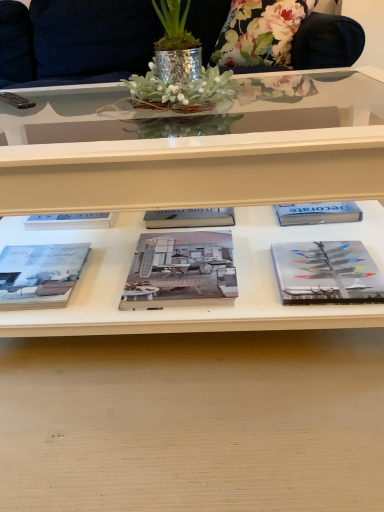
The height and width of the screenshot is (512, 384). Describe the element at coordinates (326, 273) in the screenshot. I see `gray matte book at right, which is the 3th book from left to right` at that location.

This screenshot has width=384, height=512. What are the coordinates of `black plastic remote control at upper left` in the screenshot? It's located at (16, 100).

The height and width of the screenshot is (512, 384). Describe the element at coordinates (39, 274) in the screenshot. I see `matte gray book at lower left, which is the 1th book in left-to-right order` at that location.

Measure the distance between floral fabric pillow at upper center and camera.

floral fabric pillow at upper center is 1.83 meters from camera.

The height and width of the screenshot is (512, 384). In order to click on shiny metallic pot at center in this screenshot , I will do `click(177, 69)`.

Which point is more distant from viewer, (277, 269) or (38, 396)?

The point (277, 269) is more distant.

Is gray matte book at right, which is the 3th book from left to right, positioned far away from wooden desk at center?

No, gray matte book at right, which is the 3th book from left to right, is not far from wooden desk at center.

Between gray matte book at right, which is the 3th book from left to right, and wooden desk at center, which one is positioned behind?

gray matte book at right, which is the 3th book from left to right, is further away from the camera.

Can you confirm if gray matte book at right, which is the 3th book from left to right, is bigger than wooden desk at center?

Incorrect, gray matte book at right, which is the 3th book from left to right, is not larger than wooden desk at center.

From a real-world perspective, is shiny metallic pot at center physically below black plastic remote control at upper left?

No, from a real-world perspective, shiny metallic pot at center is not under black plastic remote control at upper left.

Which is behind, point (197, 86) or point (13, 95)?

The point (13, 95) is farther from the camera.

Are shiny metallic pot at center and black plastic remote control at upper left making contact?

There is a gap between shiny metallic pot at center and black plastic remote control at upper left.

Which of these two, shiny metallic pot at center or black plastic remote control at upper left, is wider?

With larger width is shiny metallic pot at center.

Is wooden desk at center closer to the viewer compared to floral fabric pillow at upper center?

Yes, wooden desk at center is closer to the viewer.

How different are the orientations of wooden desk at center and floral fabric pillow at upper center in degrees?

wooden desk at center and floral fabric pillow at upper center are facing 148 degrees away from each other.

Is wooden desk at center thinner than floral fabric pillow at upper center?

In fact, wooden desk at center might be wider than floral fabric pillow at upper center.

From a real-world perspective, is shiny metallic pot at center physically located above or below floral fabric pillow at upper center?

Clearly, from a real-world perspective, shiny metallic pot at center is above floral fabric pillow at upper center.

Between shiny metallic pot at center and floral fabric pillow at upper center, which one appears on the right side from the viewer's perspective?

floral fabric pillow at upper center.

I want to click on flower that is under the shiny metallic pot at center (from a real-world perspective), so click(x=260, y=33).

From a real-world perspective, which is physically below, gray matte book at right, acting as the 1th book starting from the right, or black plastic remote control at upper left?

gray matte book at right, acting as the 1th book starting from the right, is physically lower.

Does gray matte book at right, which is the 3th book from left to right, have a larger size compared to black plastic remote control at upper left?

Yes.

Is gray matte book at right, acting as the 1th book starting from the right, next to black plastic remote control at upper left and touching it?

There is a gap between gray matte book at right, acting as the 1th book starting from the right, and black plastic remote control at upper left.

From the image's perspective, count 2nd books downward from the black plastic remote control at upper left and point to it. Please provide its 2D coordinates.

[(326, 273)]

From the image's perspective, is shiny metallic pot at center beneath gray matte book at right, which is the 3th book from left to right?

No, from the image's perspective, shiny metallic pot at center is not beneath gray matte book at right, which is the 3th book from left to right.

In the image, is shiny metallic pot at center on the left side or the right side of gray matte book at right, which is the 3th book from left to right?

Based on their positions, shiny metallic pot at center is located to the left of gray matte book at right, which is the 3th book from left to right.

Between shiny metallic pot at center and gray matte book at right, which is the 3th book from left to right, which one is positioned in front?

shiny metallic pot at center is in front.

Measure the distance between shiny metallic pot at center and gray matte book at right, which is the 3th book from left to right.

shiny metallic pot at center and gray matte book at right, which is the 3th book from left to right, are 18.10 inches apart from each other.

Which is in front, point (11, 250) or point (334, 295)?

The point (334, 295) is closer to the camera.

Is matte gray book at lower left, which is the 1th book in left-to-right order, surrounding gray matte book at right, acting as the 1th book starting from the right?

Actually, gray matte book at right, acting as the 1th book starting from the right, is outside matte gray book at lower left, which is the 1th book in left-to-right order.

From the image's perspective, is matte gray book at lower left, marked as the third book in a right-to-left arrangement, above or below gray matte book at right, which is the 3th book from left to right?

From the image's perspective, matte gray book at lower left, marked as the third book in a right-to-left arrangement, appears below gray matte book at right, which is the 3th book from left to right.

Can you see matte gray book at lower left, marked as the third book in a right-to-left arrangement, touching gray matte book at right, which is the 3th book from left to right?

No.

Identify the location of book on the right side of wooden desk at center. (326, 273).

Identify the location of remote control below the shiny metallic pot at center (from a real-world perspective). (x=16, y=100).

Looking at the image, which one is located closer to matte gray book at lower left, marked as the third book in a right-to-left arrangement, gray matte book at right, acting as the 1th book starting from the right, or wooden desk at center?

The object closer to matte gray book at lower left, marked as the third book in a right-to-left arrangement, is wooden desk at center.

Looking at the image, which one is located further to floral fabric pillow at upper center, matte gray book at center, positioned as the second book in right-to-left order, or black plastic remote control at upper left?

matte gray book at center, positioned as the second book in right-to-left order, is positioned further to the anchor floral fabric pillow at upper center.

Considering their positions, is matte gray book at lower left, which is the 1th book in left-to-right order, positioned further to floral fabric pillow at upper center than black plastic remote control at upper left?

matte gray book at lower left, which is the 1th book in left-to-right order, is further to floral fabric pillow at upper center.

Looking at this image, which object lies further to the anchor point gray matte book at right, which is the 3th book from left to right, black plastic remote control at upper left or shiny metallic pot at center?

The object further to gray matte book at right, which is the 3th book from left to right, is black plastic remote control at upper left.

Which object lies further to the anchor point wooden desk at center, gray matte book at right, which is the 3th book from left to right, or black plastic remote control at upper left?

black plastic remote control at upper left.

Based on their spatial positions, is wooden desk at center or shiny metallic pot at center closer to matte gray book at lower left, marked as the third book in a right-to-left arrangement?

Among the two, wooden desk at center is located nearer to matte gray book at lower left, marked as the third book in a right-to-left arrangement.

Based on their spatial positions, is floral fabric pillow at upper center or black plastic remote control at upper left closer to gray matte book at right, acting as the 1th book starting from the right?

black plastic remote control at upper left is closer to gray matte book at right, acting as the 1th book starting from the right.

Based on their spatial positions, is floral fabric pillow at upper center or shiny metallic pot at center closer to matte gray book at lower left, marked as the third book in a right-to-left arrangement?

shiny metallic pot at center is closer to matte gray book at lower left, marked as the third book in a right-to-left arrangement.

You are a GUI agent. You are given a task and a screenshot of the screen. Output one action in this format:
    pyautogui.click(x=<x>, y=<y>)
    Task: Click on the remote control between floral fabric pillow at upper center and matte gray book at center, positioned as the second book in right-to-left order, from top to bottom
    
    Given the screenshot: What is the action you would take?
    pyautogui.click(x=16, y=100)

Image resolution: width=384 pixels, height=512 pixels. What are the coordinates of `book between floral fabric pillow at upper center and gray matte book at right, acting as the 1th book starting from the right, in the up-down direction` in the screenshot? It's located at (180, 270).

The width and height of the screenshot is (384, 512). What are the coordinates of `remote control that lies between shiny metallic pot at center and matte gray book at lower left, marked as the third book in a right-to-left arrangement, from top to bottom` in the screenshot? It's located at (16, 100).

This screenshot has width=384, height=512. Find the location of `book that lies between shiny metallic pot at center and gray matte book at right, which is the 3th book from left to right, from top to bottom`. book that lies between shiny metallic pot at center and gray matte book at right, which is the 3th book from left to right, from top to bottom is located at coordinates (180, 270).